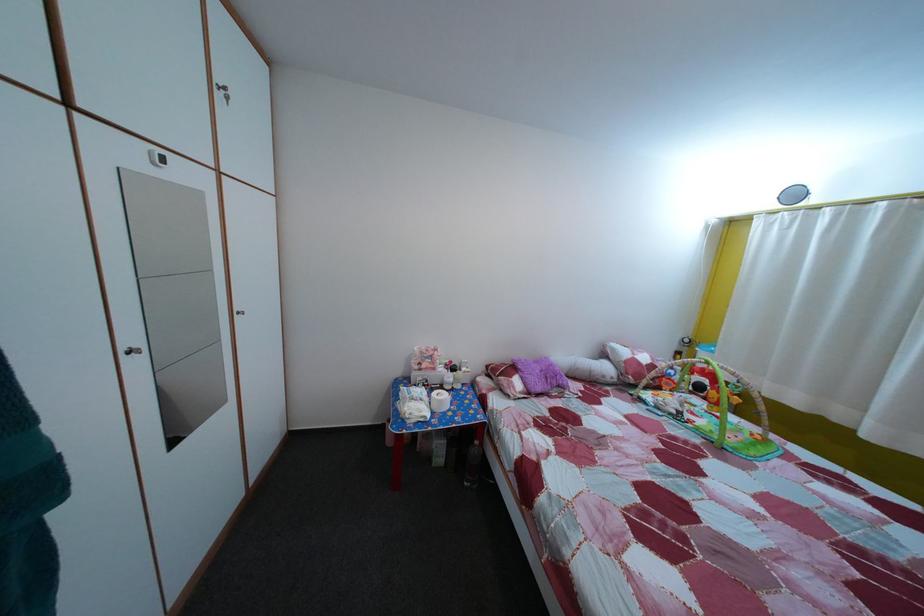
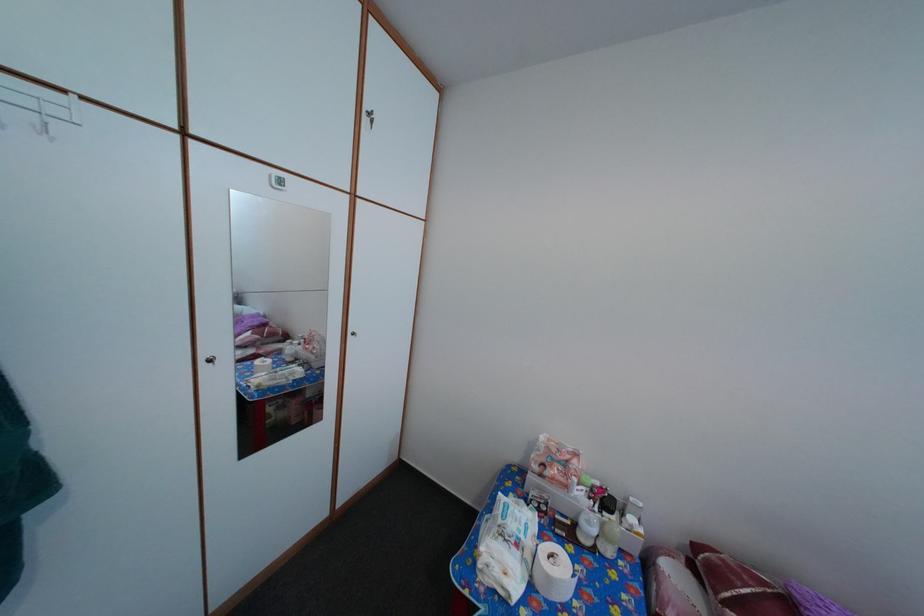
In the second image, find the point that corresponds to point (496, 374) in the first image.

(704, 554)